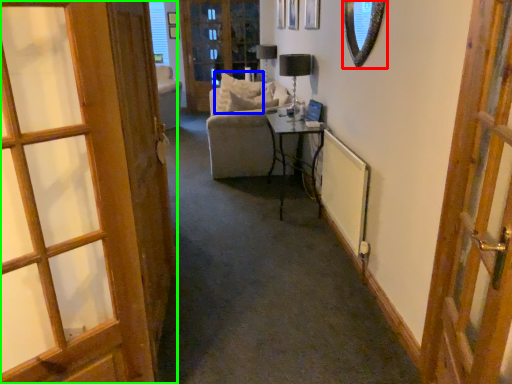
Question: Which object is positioned farthest from mirror (highlighted by a red box)? Select from pillow (highlighted by a blue box) and door (highlighted by a green box).

Choices:
 (A) pillow
 (B) door

Answer: (A)